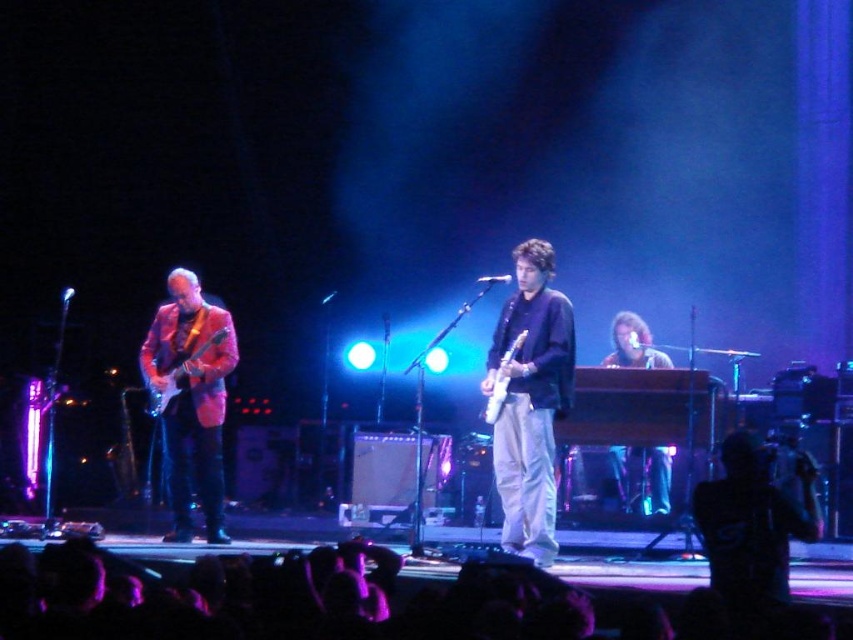
You are a photographer at the back of the venue trying to capture the shiny pink jacket at left and the shiny metallic guitar at left on stage. Based on their sizes in the image, which one would appear larger in your photo?

The shiny pink jacket at left is much taller than the shiny metallic guitar at left, so it would appear larger in the photo.

You are a photographer in the crowd trying to capture the stage. You notice two guitars at the center of the stage. Which guitar is more to the right? The matte black guitar at center or the white glossy electric guitar at center?

The matte black guitar at center is positioned on the right side of the white glossy electric guitar at center, so the matte black guitar at center is more to the right.

You are a photographer backstage who wants to capture a closeup of the matte black guitar at center and the white glossy electric guitar at center during the performance. Which guitar will appear larger in your photo?

The matte black guitar at center will appear larger in the photo because it is closer to the viewer than the white glossy electric guitar at center.